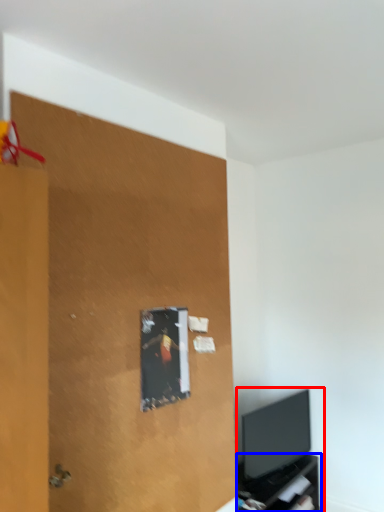
Question: Which of the following is the farthest to the observer, entertainment center (highlighted by a red box) or tv cabinet (highlighted by a blue box)?

Choices:
 (A) entertainment center
 (B) tv cabinet

Answer: (A)